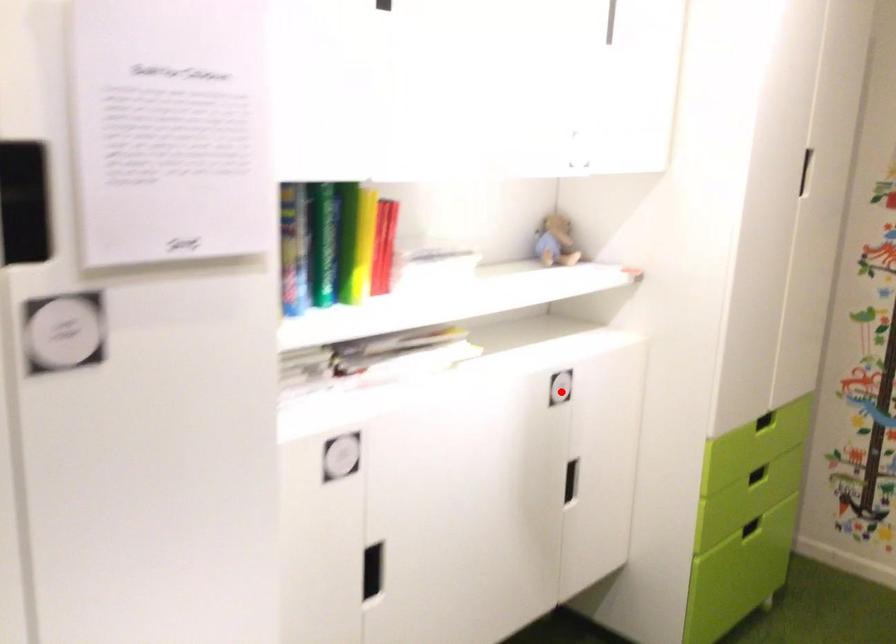
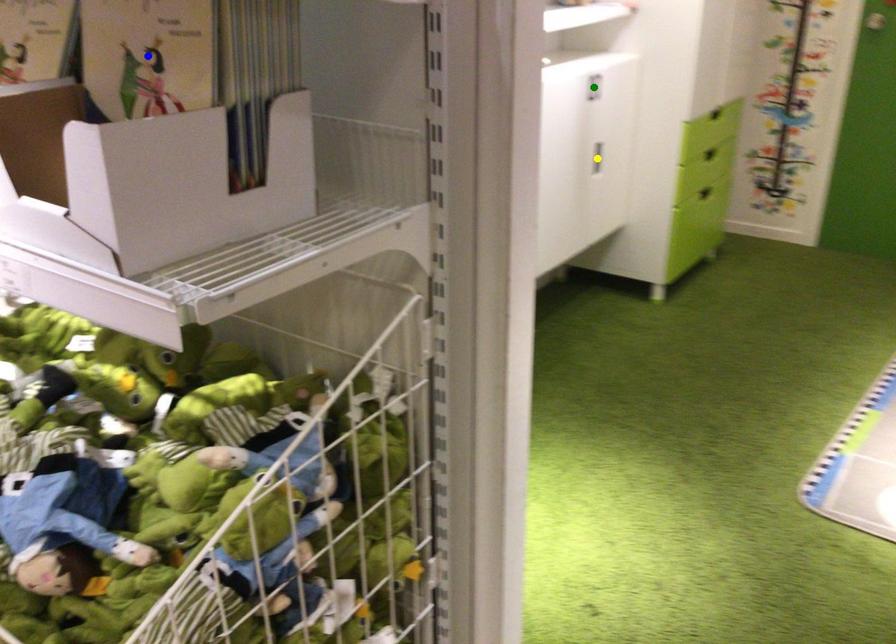
Question: I am providing you with two images of the same scene from different viewpoints. A red point is marked on the first image. You are given multiple points on the second image. In image 2, which mark is for the same physical point as the one in image 1?

Choices:
 (A) green point
 (B) yellow point
 (C) blue point

Answer: (A)